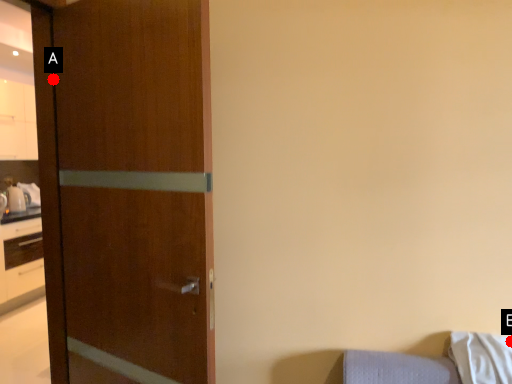
Question: Two points are circled on the image, labeled by A and B beside each circle. Which point is closer to the camera?

Choices:
 (A) A is closer
 (B) B is closer

Answer: (B)